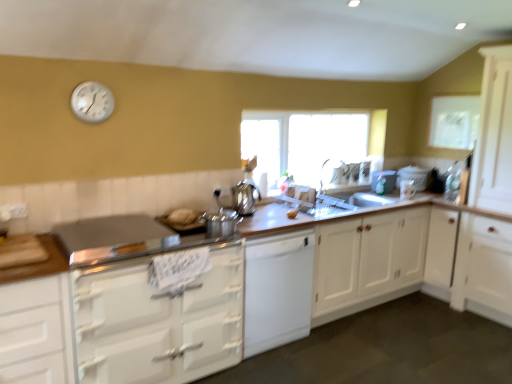
This screenshot has width=512, height=384. I want to click on unoccupied region to the right of yellow matte apple at center, so click(308, 220).